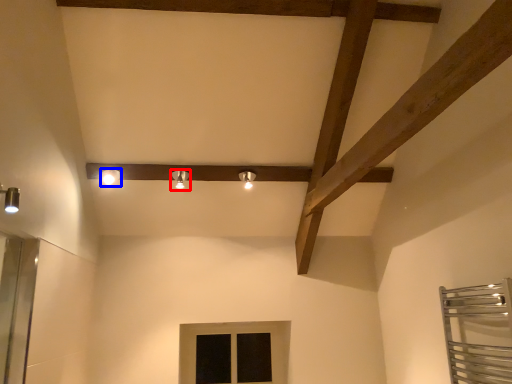
Question: Among these objects, which one is farthest to the camera, light fixture (highlighted by a red box) or light fixture (highlighted by a blue box)?

Choices:
 (A) light fixture
 (B) light fixture

Answer: (A)